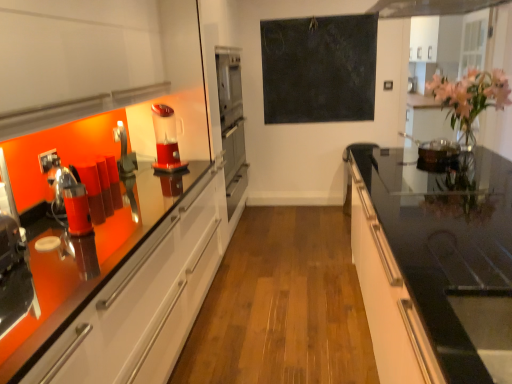
Question: Considering the relative positions of dark matte chalkboard at center and black glass countertop at right in the image provided, is dark matte chalkboard at center to the left of black glass countertop at right from the viewer's perspective?

Choices:
 (A) no
 (B) yes

Answer: (B)

Question: Does dark matte chalkboard at center have a lesser height compared to black glass countertop at right?

Choices:
 (A) yes
 (B) no

Answer: (B)

Question: From a real-world perspective, is dark matte chalkboard at center under black glass countertop at right?

Choices:
 (A) yes
 (B) no

Answer: (B)

Question: From a real-world perspective, is dark matte chalkboard at center located higher than black glass countertop at right?

Choices:
 (A) no
 (B) yes

Answer: (B)

Question: Is dark matte chalkboard at center oriented towards black glass countertop at right?

Choices:
 (A) yes
 (B) no

Answer: (A)

Question: Does dark matte chalkboard at center have a lesser width compared to black glass countertop at right?

Choices:
 (A) yes
 (B) no

Answer: (A)

Question: From the image's perspective, does pink glossy vase at upper right appear lower than black glass countertop at right?

Choices:
 (A) no
 (B) yes

Answer: (A)

Question: Is pink glossy vase at upper right oriented away from black glass countertop at right?

Choices:
 (A) no
 (B) yes

Answer: (A)

Question: Is pink glossy vase at upper right to the right of black glass countertop at right from the viewer's perspective?

Choices:
 (A) no
 (B) yes

Answer: (B)

Question: Is pink glossy vase at upper right behind black glass countertop at right?

Choices:
 (A) no
 (B) yes

Answer: (B)

Question: Is pink glossy vase at upper right with black glass countertop at right?

Choices:
 (A) no
 (B) yes

Answer: (A)

Question: From the image's perspective, does pink glossy vase at upper right appear higher than black glass countertop at right?

Choices:
 (A) yes
 (B) no

Answer: (A)

Question: From the image's perspective, does black glass countertop at right appear lower than red plastic blender at center, placed as the second coffee machine when sorted from front to back?

Choices:
 (A) yes
 (B) no

Answer: (A)